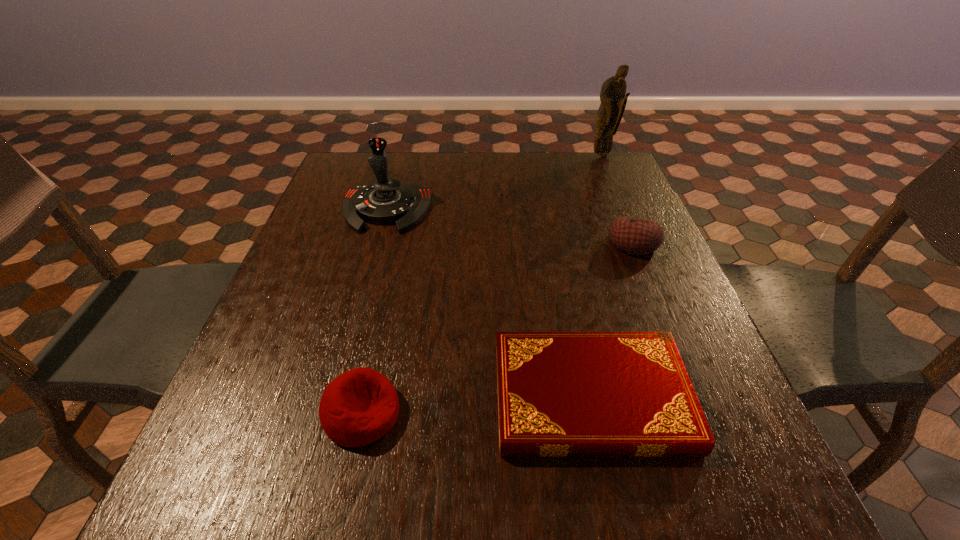
Locate an element on the screen. object that is at the far right corner is located at coordinates (612, 96).

Find the location of a particular element. This screenshot has height=540, width=960. vacant area at the far edge is located at coordinates (441, 158).

You are a GUI agent. You are given a task and a screenshot of the screen. Output one action in this format:
    pyautogui.click(x=<x>, y=<y>)
    Task: Click on the free space at the left edge of the desktop
    This screenshot has height=540, width=960.
    Given the screenshot: What is the action you would take?
    pyautogui.click(x=337, y=228)

At what (x,y) coordinates should I click in order to perform the action: click on vacant area at the right edge. Please return your answer as a coordinate pair (x, y). Image resolution: width=960 pixels, height=540 pixels. Looking at the image, I should click on (726, 443).

The image size is (960, 540). In the image, there is a desktop. Find the location of `vacant space at the far right corner`. vacant space at the far right corner is located at coordinates (623, 172).

This screenshot has height=540, width=960. Find the location of `blank space at the near right corner of the desktop`. blank space at the near right corner of the desktop is located at coordinates (704, 522).

Identify the location of free spot between the shortest object and the second tallest object. The width and height of the screenshot is (960, 540). (489, 304).

Identify the location of vacant region between the left beanbag and the hardback book. (476, 405).

Identify the location of empty space that is in between the joystick and the left beanbag. (373, 312).

Locate an element on the screen. This screenshot has width=960, height=540. free spot between the joystick and the tallest object is located at coordinates (493, 183).